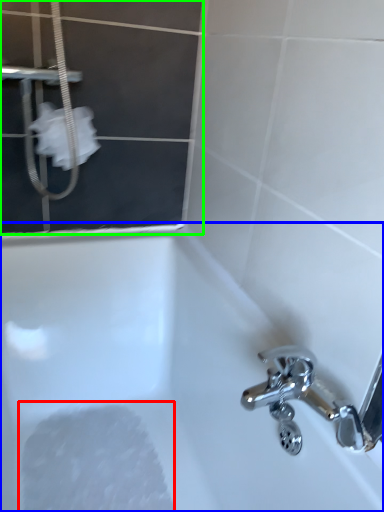
Question: Which is nearer to the foam (highlighted by a red box)? bathtub (highlighted by a blue box) or screen door (highlighted by a green box).

Choices:
 (A) bathtub
 (B) screen door

Answer: (A)